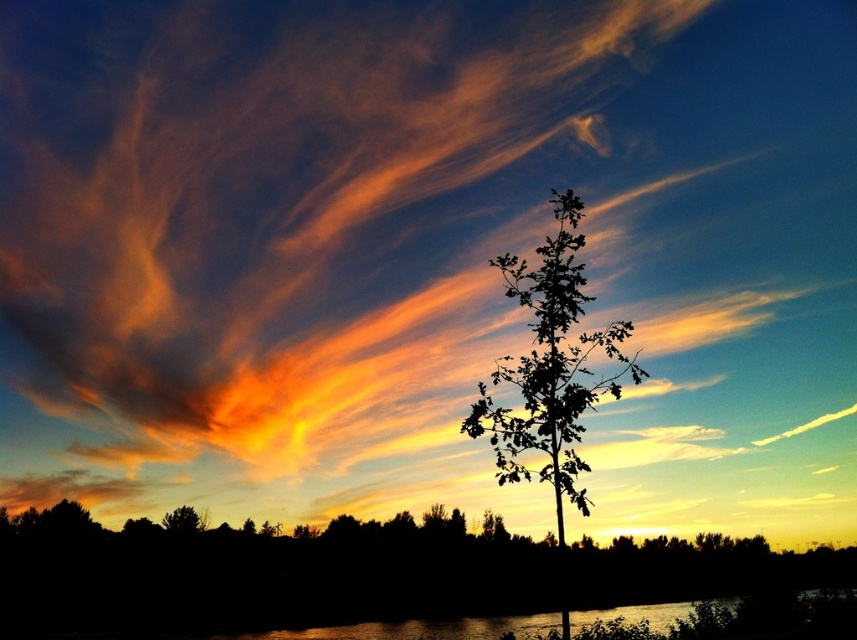
Question: Which object is closer to the camera taking this photo?

Choices:
 (A) silhouette leafy tree at center
 (B) green leafy tree at lower left

Answer: (A)

Question: Does silhouette leafy tree at center appear over green leafy tree at lower left?

Choices:
 (A) yes
 (B) no

Answer: (A)

Question: Among these objects, which one is nearest to the camera?

Choices:
 (A) silhouette leafy tree at center
 (B) green leafy tree at lower left

Answer: (A)

Question: Is the position of silhouette leafy tree at center less distant than that of green leafy tree at lower left?

Choices:
 (A) no
 (B) yes

Answer: (B)

Question: Which object appears closest to the camera in this image?

Choices:
 (A) green leafy tree at lower left
 (B) silhouette leafy tree at center

Answer: (B)

Question: Observing the image, what is the correct spatial positioning of silhouette leafy tree at center in reference to green leafy tree at lower left?

Choices:
 (A) above
 (B) below

Answer: (A)